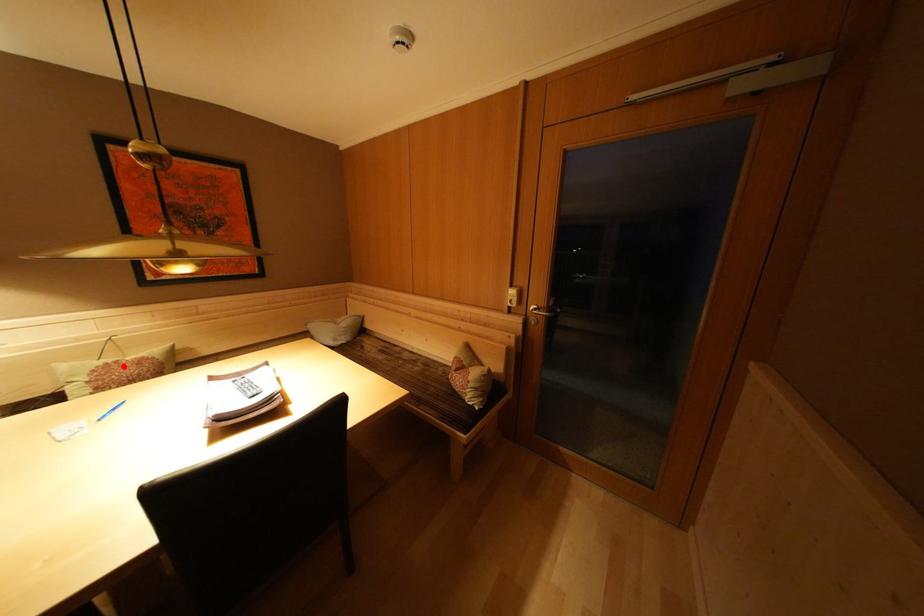
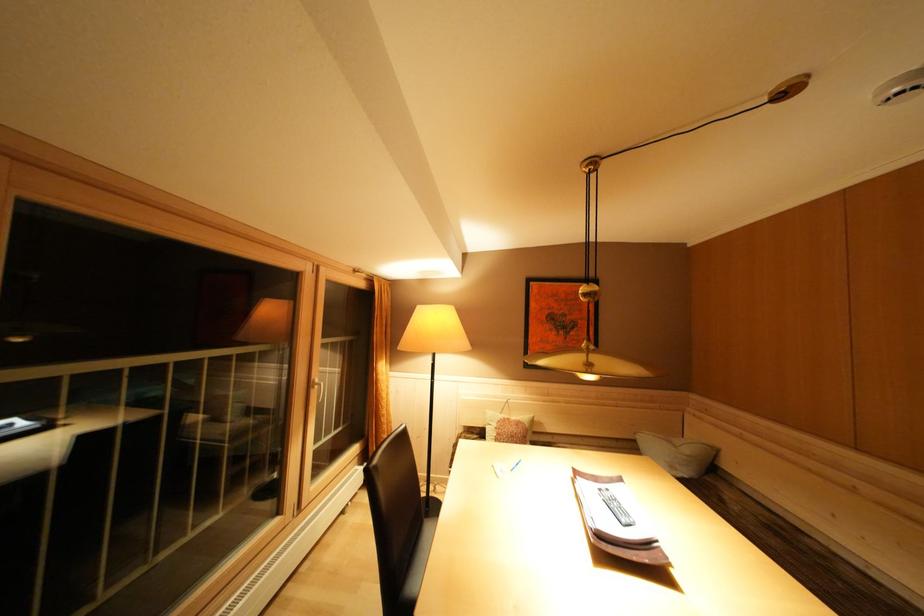
Question: I am providing you with two images of the same scene from different viewpoints. A red point is shown in image1. For the corresponding object point in image2, is it positioned nearer or farther from the camera?

Choices:
 (A) Nearer
 (B) Farther

Answer: (B)